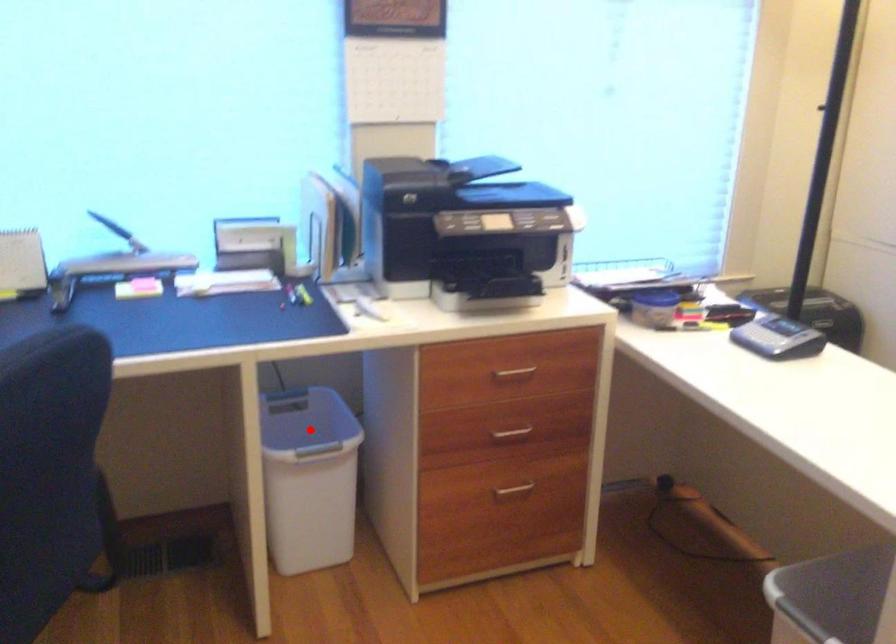
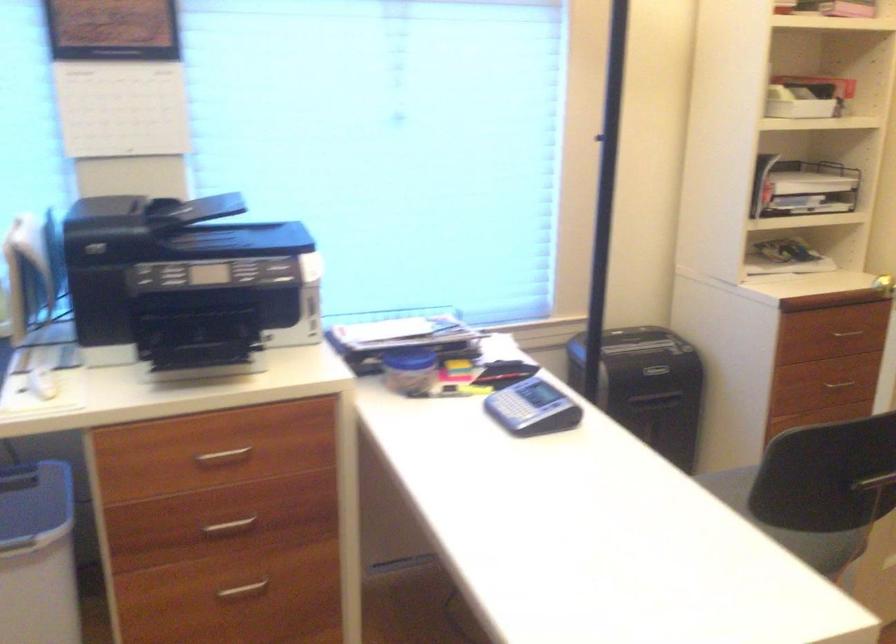
In the second image, find the point that corresponds to the highlighted location in the first image.

(35, 513)